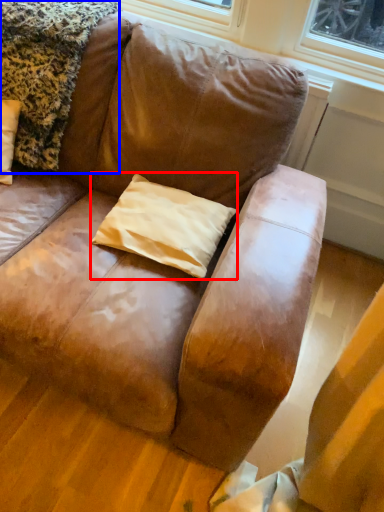
Question: Which of the following is the farthest to the observer, pillow (highlighted by a red box) or blanket (highlighted by a blue box)?

Choices:
 (A) pillow
 (B) blanket

Answer: (A)